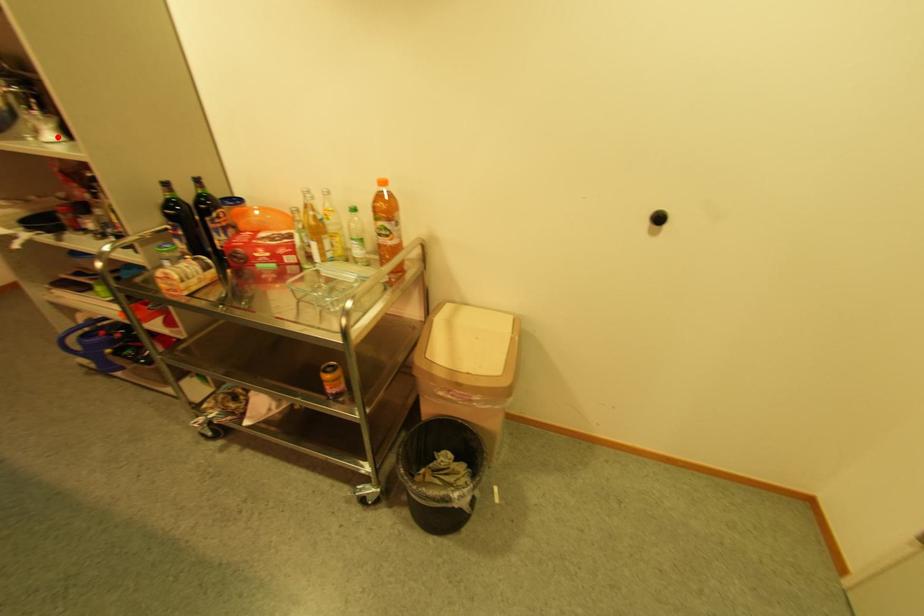
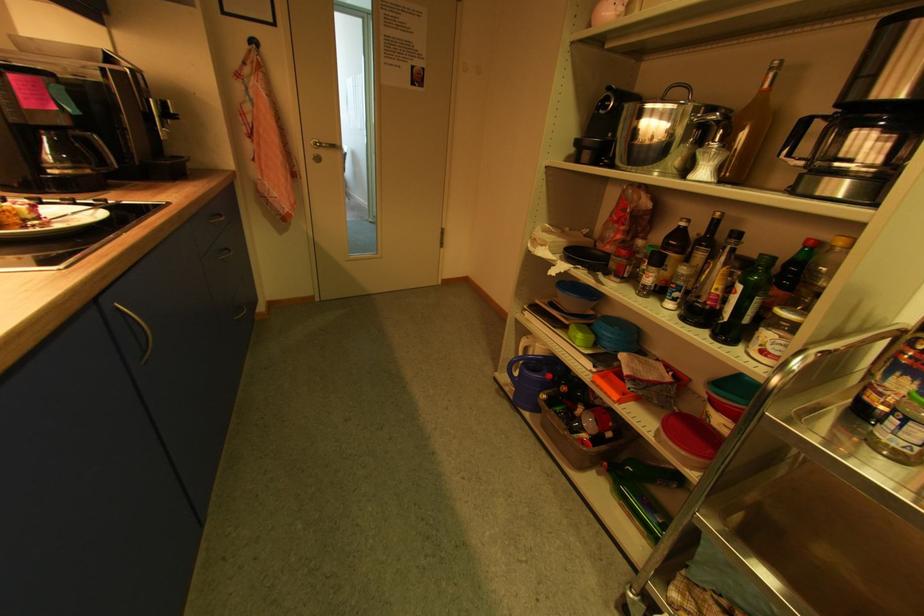
The point at the highlighted location is marked in the first image. Where is the corresponding point in the second image?

(709, 175)